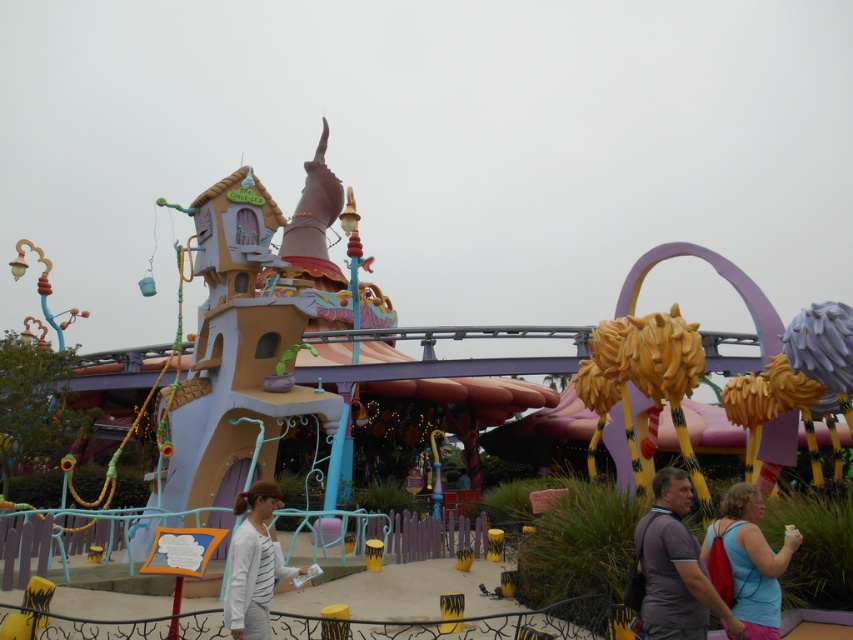
Question: Which is farther from the blue fabric backpack at lower right?

Choices:
 (A) white striped shirt at center
 (B) gray fabric shirt at lower center

Answer: (A)

Question: Among these objects, which one is nearest to the camera?

Choices:
 (A) white striped shirt at center
 (B) blue fabric backpack at lower right
 (C) gray fabric shirt at lower center

Answer: (A)

Question: Which point is closer to the camera taking this photo?

Choices:
 (A) (262, 544)
 (B) (706, 529)
 (C) (676, 625)

Answer: (C)

Question: Considering the relative positions of gray fabric shirt at lower center and white striped shirt at center in the image provided, where is gray fabric shirt at lower center located with respect to white striped shirt at center?

Choices:
 (A) right
 (B) left

Answer: (A)

Question: Can you confirm if gray fabric shirt at lower center is smaller than white striped shirt at center?

Choices:
 (A) no
 (B) yes

Answer: (B)

Question: Is blue fabric backpack at lower right positioned before white striped shirt at center?

Choices:
 (A) yes
 (B) no

Answer: (B)